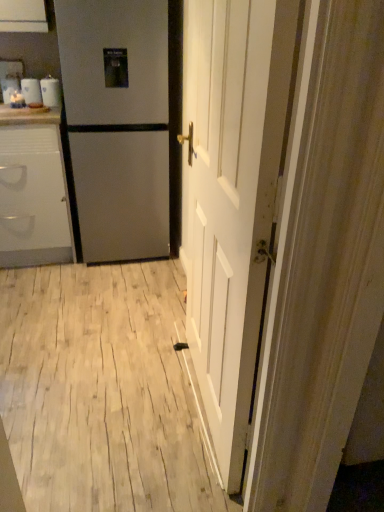
You are a GUI agent. You are given a task and a screenshot of the screen. Output one action in this format:
    pyautogui.click(x=<x>, y=<y>)
    Task: Click on the free space to the back side of white wooden door at center
    Image resolution: width=384 pixels, height=512 pixels.
    Given the screenshot: What is the action you would take?
    pyautogui.click(x=151, y=327)